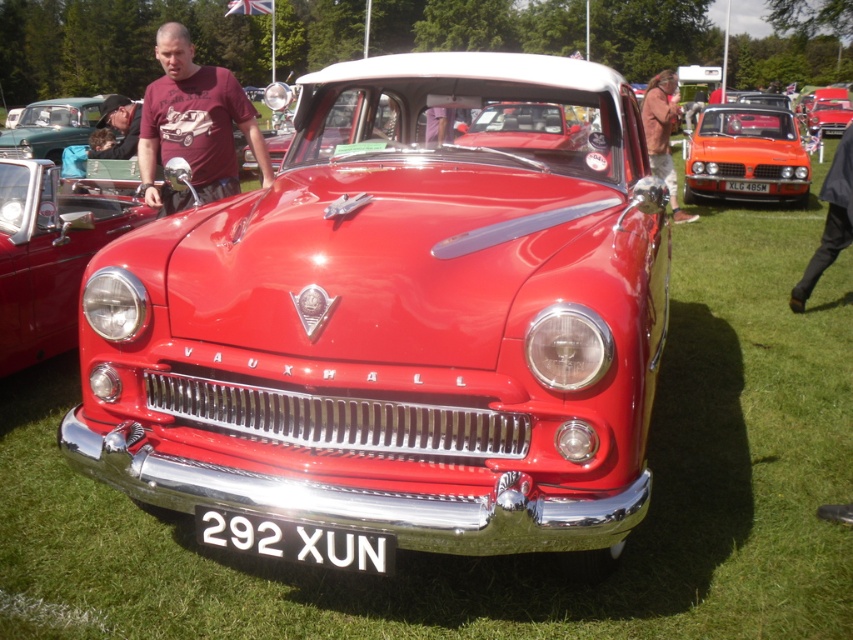
You are a photographer at the car show and need to capture both the white metallic license plate at center and the dark brown leather jacket at upper left in a single shot. Which object will appear smaller in the photo?

The white metallic license plate at center will appear smaller in the photo because it occupies less space than the dark brown leather jacket at upper left.

Where is the shiny chrome headlight at center located in the image?

The shiny chrome headlight at center is located at point (48, 257).

You are standing in front of the classic red Vauxhall car at the exhibition. You notice two points marked on the car, one at coordinates point (242, 540) and the other at point (138, 124). Which of these points is nearer to you?

Point (242, 540) is closer to the camera than point (138, 124), so the point at coordinates point (242, 540) is nearer to you.